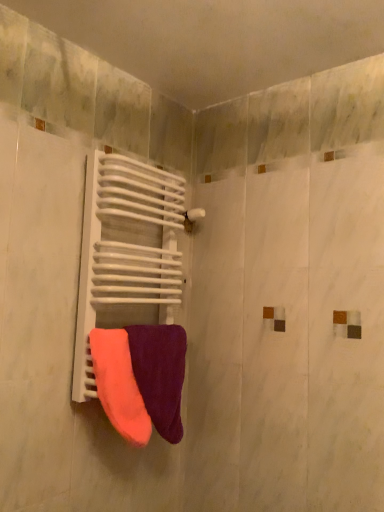
Question: Is velvet purple towel at center, acting as the 1th towel starting from the right, taller than white matte radiator at center?

Choices:
 (A) yes
 (B) no

Answer: (B)

Question: Is velvet purple towel at center, which appears as the second towel when viewed from the left, oriented away from white matte radiator at center?

Choices:
 (A) yes
 (B) no

Answer: (A)

Question: Does velvet purple towel at center, acting as the 1th towel starting from the right, have a greater width compared to white matte radiator at center?

Choices:
 (A) yes
 (B) no

Answer: (B)

Question: Is velvet purple towel at center, which appears as the second towel when viewed from the left, surrounding white matte radiator at center?

Choices:
 (A) no
 (B) yes

Answer: (A)

Question: Considering the relative sizes of velvet purple towel at center, acting as the 1th towel starting from the right, and white matte radiator at center in the image provided, is velvet purple towel at center, acting as the 1th towel starting from the right, smaller than white matte radiator at center?

Choices:
 (A) no
 (B) yes

Answer: (B)

Question: Is velvet purple towel at center, which appears as the second towel when viewed from the left, not within white matte radiator at center?

Choices:
 (A) no
 (B) yes

Answer: (B)

Question: Does white matte radiator at center have a lesser width compared to velvet purple towel at center, which appears as the second towel when viewed from the left?

Choices:
 (A) no
 (B) yes

Answer: (A)

Question: From a real-world perspective, is white matte radiator at center positioned under velvet purple towel at center, acting as the 1th towel starting from the right, based on gravity?

Choices:
 (A) yes
 (B) no

Answer: (B)

Question: Does white matte radiator at center lie in front of velvet purple towel at center, acting as the 1th towel starting from the right?

Choices:
 (A) yes
 (B) no

Answer: (A)

Question: Are white matte radiator at center and velvet purple towel at center, which appears as the second towel when viewed from the left, beside each other?

Choices:
 (A) yes
 (B) no

Answer: (B)

Question: Considering the relative positions of white matte radiator at center and velvet purple towel at center, which appears as the second towel when viewed from the left, in the image provided, is white matte radiator at center to the left of velvet purple towel at center, which appears as the second towel when viewed from the left, from the viewer's perspective?

Choices:
 (A) yes
 (B) no

Answer: (A)

Question: Is white matte radiator at center positioned behind velvet purple towel at center, which appears as the second towel when viewed from the left?

Choices:
 (A) no
 (B) yes

Answer: (A)

Question: Does neon orange fabric towel at center, the 2th towel from the right, have a smaller size compared to white matte radiator at center?

Choices:
 (A) yes
 (B) no

Answer: (A)